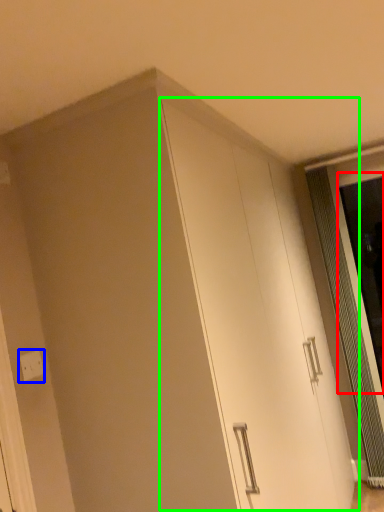
Question: Estimate the real-world distances between objects in this image. Which object is closer to screen door (highlighted by a red box), electric outlet (highlighted by a blue box) or cabinetry (highlighted by a green box)?

Choices:
 (A) electric outlet
 (B) cabinetry

Answer: (B)